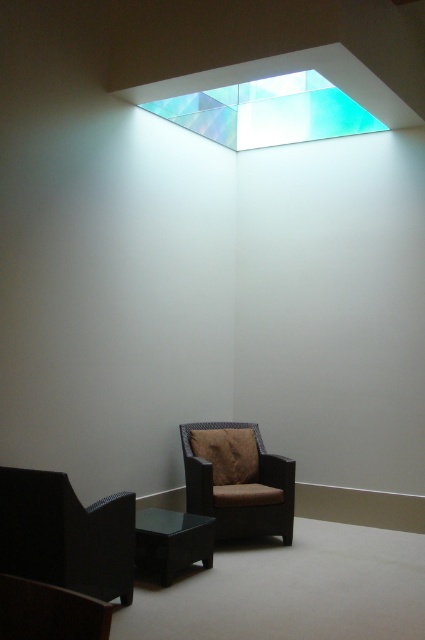
Question: Which object is positioned closest to the black glass coffee table at lower center?

Choices:
 (A) matte black armchair at lower left
 (B) brown woven armchair at lower center

Answer: (B)

Question: Which object is closer to the camera taking this photo?

Choices:
 (A) matte black armchair at lower left
 (B) black glass coffee table at lower center

Answer: (A)

Question: Is brown woven armchair at lower center to the left of black glass coffee table at lower center from the viewer's perspective?

Choices:
 (A) no
 (B) yes

Answer: (A)

Question: Is matte black armchair at lower left wider than brown woven armchair at lower center?

Choices:
 (A) yes
 (B) no

Answer: (B)

Question: Which object is the closest to the brown woven armchair at lower center?

Choices:
 (A) black glass coffee table at lower center
 (B) matte black armchair at lower left

Answer: (A)

Question: Is brown woven armchair at lower center wider than black glass coffee table at lower center?

Choices:
 (A) no
 (B) yes

Answer: (B)